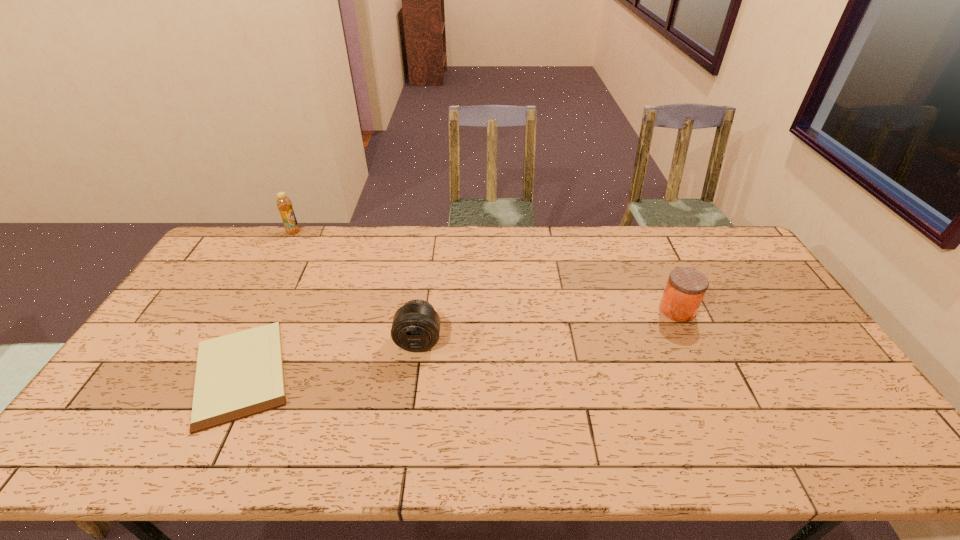
This screenshot has width=960, height=540. I want to click on object present at the far edge, so click(x=284, y=204).

Identify the location of object situated at the near edge. (239, 375).

Where is `object situated at the left edge`? This screenshot has width=960, height=540. object situated at the left edge is located at coordinates (239, 375).

Locate an element on the screen. object that is at the near left corner is located at coordinates (239, 375).

Locate an element on the screen. The height and width of the screenshot is (540, 960). vacant space at the far edge of the desktop is located at coordinates (667, 257).

Where is `blank space at the near edge of the desktop`? Image resolution: width=960 pixels, height=540 pixels. blank space at the near edge of the desktop is located at coordinates click(x=508, y=461).

Find the location of a particular element. vacant space at the left edge of the desktop is located at coordinates (114, 414).

The height and width of the screenshot is (540, 960). In order to click on vacant area at the right edge in this screenshot , I will do `click(749, 269)`.

Where is `free point at the far left corner`? The height and width of the screenshot is (540, 960). free point at the far left corner is located at coordinates (215, 251).

I want to click on vacant space at the near left corner, so click(x=129, y=456).